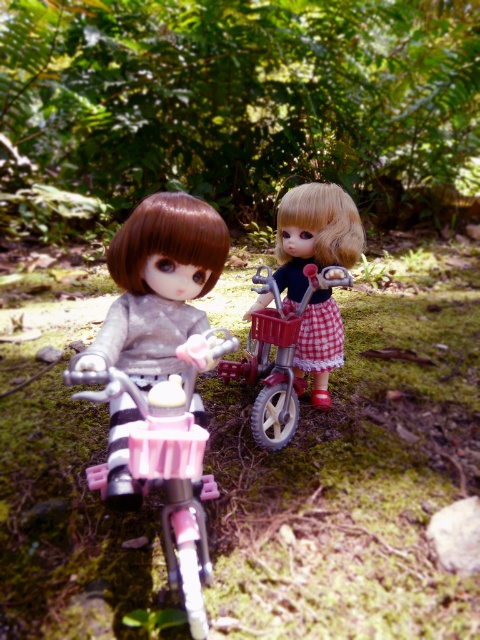
You are a photographer trying to capture a clear shot of both the matte black doll at center and the metallic silver bicycle at center. Since you want to ensure both subjects are in focus, you need to know their relative positions. Which object is located to the right of the other?

The matte black doll at center is positioned on the right side of the metallic silver bicycle at center.

You are a toy collector trying to place the matte black doll at center and the metallic silver bicycle at center on a shelf. If the shelf has a height limit of 12 inches, can both items fit without exceeding the height limit?

The matte black doll at center is bigger than the metallic silver bicycle at center. However, without specific height measurements for each item, it is impossible to determine if their combined height exceeds the 12 inch limit. Additional information about their individual heights is needed to answer this question accurately.

You are a photographer standing in front of the scene with the matte black doll at center and the metallic silver bicycle at center. You want to take a photo that captures both objects clearly. Which object should you focus on first to ensure both are in focus?

You should focus on the matte black doll at center first because it is closer to you than the metallic silver bicycle at center, ensuring both will be in focus when focused on the closer object.